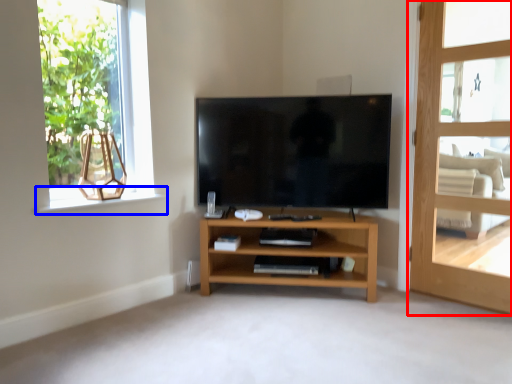
Question: Which object is closer to the camera taking this photo, door (highlighted by a red box) or window sill (highlighted by a blue box)?

Choices:
 (A) door
 (B) window sill

Answer: (A)